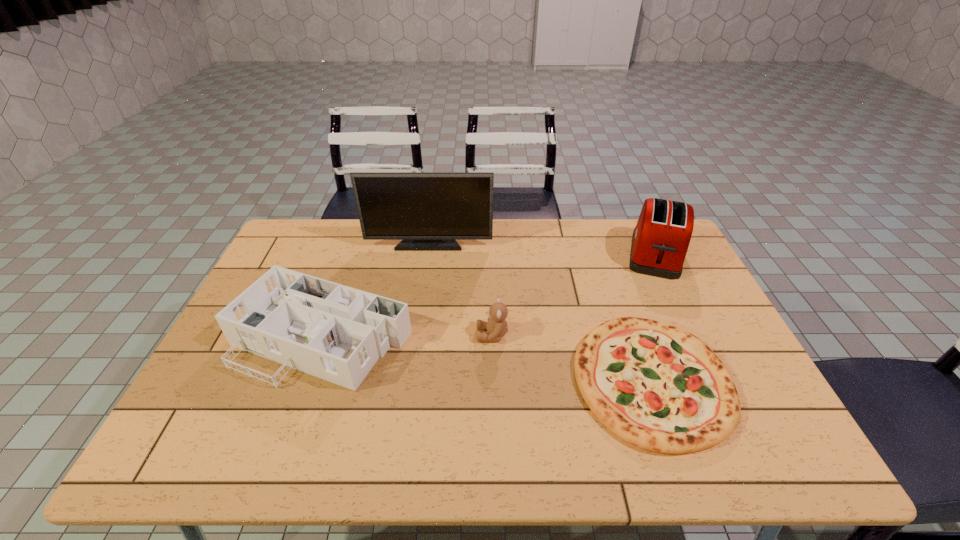
Find the location of a particular element. the tallest object is located at coordinates (428, 211).

The height and width of the screenshot is (540, 960). What are the coordinates of `toaster` in the screenshot? It's located at (660, 240).

This screenshot has width=960, height=540. Find the location of `teddy bear`. teddy bear is located at coordinates (497, 327).

Where is `dollhouse`? The height and width of the screenshot is (540, 960). dollhouse is located at coordinates (337, 333).

You are a GUI agent. You are given a task and a screenshot of the screen. Output one action in this format:
    pyautogui.click(x=<x>, y=<y>)
    Task: Click on the pizza
    
    Given the screenshot: What is the action you would take?
    pyautogui.click(x=658, y=387)

Find the location of a particular element. blank area located on the screen side of the tallest object is located at coordinates (422, 291).

Where is `vacant space situated on the front of the toaster`? The height and width of the screenshot is (540, 960). vacant space situated on the front of the toaster is located at coordinates (674, 293).

Where is `vacant space situated 0.360m on the face of the teddy bear`? The width and height of the screenshot is (960, 540). vacant space situated 0.360m on the face of the teddy bear is located at coordinates (345, 335).

At what (x,y) coordinates should I click in order to perform the action: click on vacant space located 0.090m on the face of the teddy bear. Please return your answer as a coordinate pair (x, y). The height and width of the screenshot is (540, 960). Looking at the image, I should click on (444, 335).

Where is `free space located 0.110m on the face of the teddy bear`? This screenshot has height=540, width=960. free space located 0.110m on the face of the teddy bear is located at coordinates (436, 335).